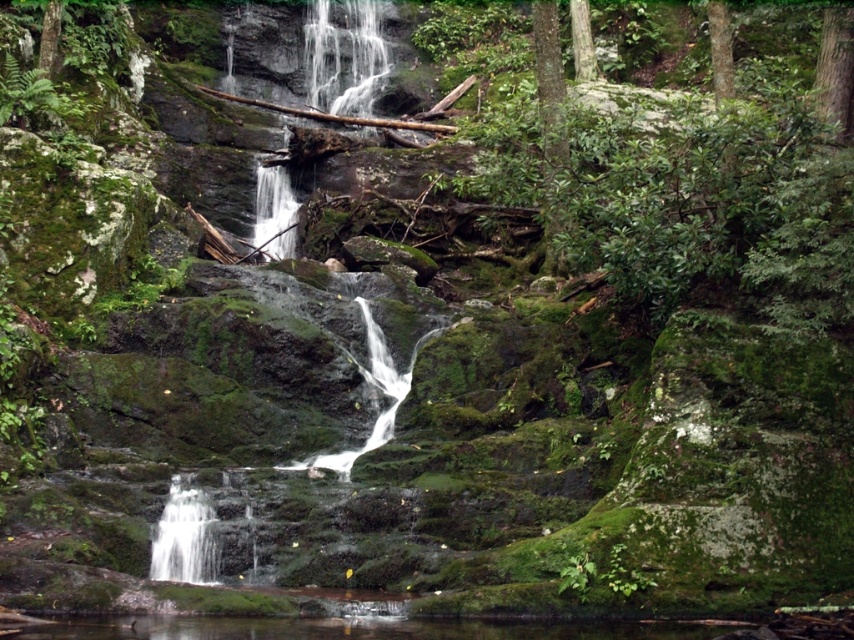
You are a photographer trying to capture the waterfall. You want to know which part of the water is bigger to focus your camera. Which is larger, the clear water at center or the white frothy water at upper center?

The clear water at center is larger in size than the white frothy water at upper center, so you should focus on the clear water at center for a better shot.

Imagine you are standing at the bottom of the waterfall and want to locate the green mossy tree at upper right. Based on the coordinates provided, in which direction should you look to find it?

The green mossy tree at upper right is located at coordinates point (548, 81), so you should look towards the upper right direction to find it.